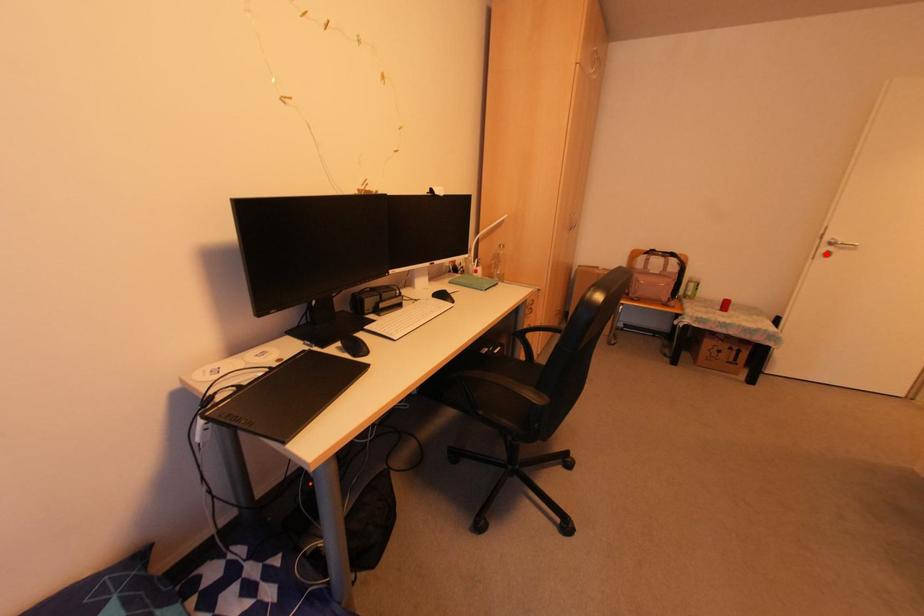
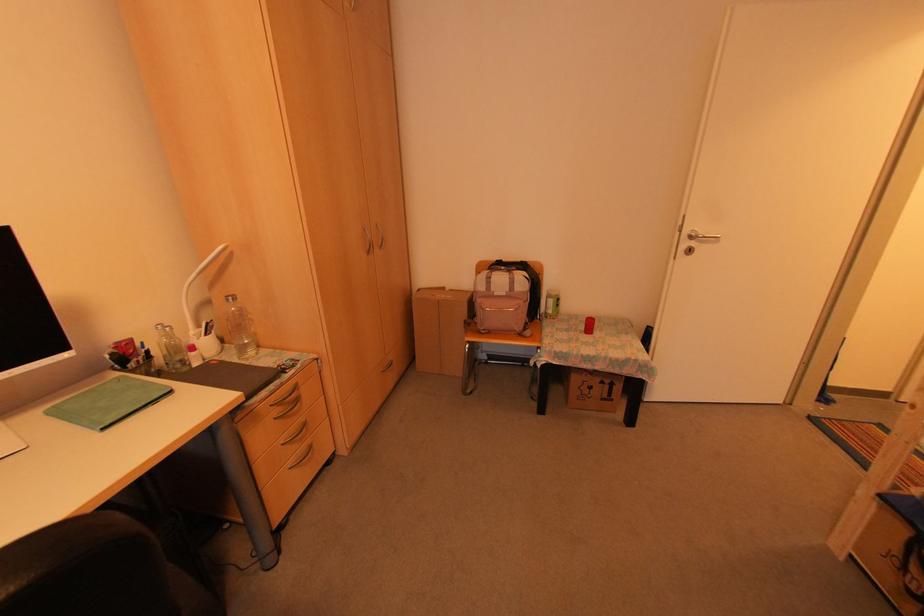
Find the pixel in the second image that matches the highlighted location in the first image.

(687, 251)